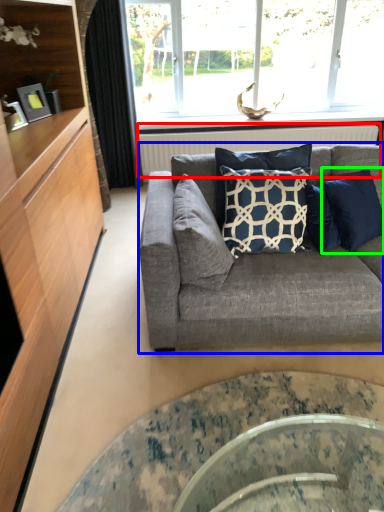
Question: Estimate the real-world distances between objects in this image. Which object is closer to radiator (highlighted by a red box), studio couch (highlighted by a blue box) or pillow (highlighted by a green box)?

Choices:
 (A) studio couch
 (B) pillow

Answer: (B)